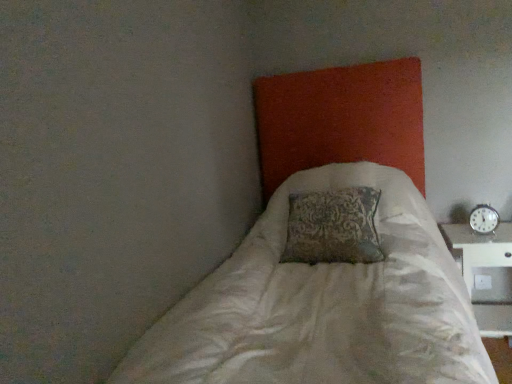
Question: Considering the positions of point (490, 216) and point (457, 261), is point (490, 216) closer or farther from the camera than point (457, 261)?

Choices:
 (A) farther
 (B) closer

Answer: (A)

Question: From the image's perspective, is metallic silver clock at right positioned above or below white plastic table at right?

Choices:
 (A) above
 (B) below

Answer: (A)

Question: Based on their relative distances, which object is farther from the white textured bed at center?

Choices:
 (A) metallic silver clock at right
 (B) white plastic table at right

Answer: (A)

Question: Based on their relative distances, which object is farther from the white textured bed at center?

Choices:
 (A) metallic silver clock at right
 (B) white plastic table at right

Answer: (A)